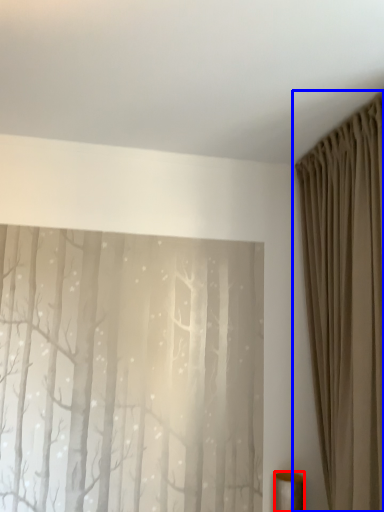
Question: Which object appears closest to the camera in this image, furniture (highlighted by a red box) or curtain (highlighted by a blue box)?

Choices:
 (A) furniture
 (B) curtain

Answer: (B)